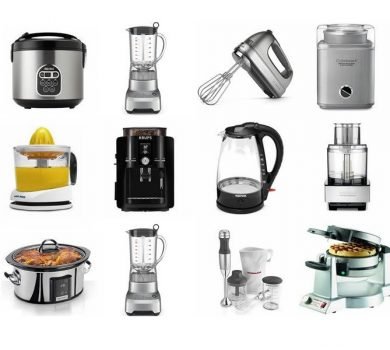
Find the location of a particular element. silver based transparent blenders with handle is located at coordinates (146, 266), (148, 66).